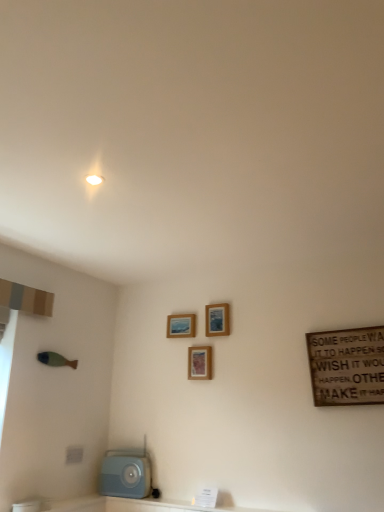
Question: From the image's perspective, is wooden signboard at right on light blue plastic radio at lower left?

Choices:
 (A) no
 (B) yes

Answer: (B)

Question: From a real-world perspective, is wooden signboard at right positioned over light blue plastic radio at lower left based on gravity?

Choices:
 (A) yes
 (B) no

Answer: (A)

Question: Can you confirm if wooden signboard at right is bigger than light blue plastic radio at lower left?

Choices:
 (A) yes
 (B) no

Answer: (B)

Question: From a real-world perspective, is wooden signboard at right physically below light blue plastic radio at lower left?

Choices:
 (A) no
 (B) yes

Answer: (A)

Question: Can you confirm if wooden signboard at right is shorter than light blue plastic radio at lower left?

Choices:
 (A) no
 (B) yes

Answer: (A)

Question: Considering the relative sizes of wooden signboard at right and light blue plastic radio at lower left in the image provided, is wooden signboard at right taller than light blue plastic radio at lower left?

Choices:
 (A) yes
 (B) no

Answer: (A)

Question: Can you confirm if wooden signboard at right is shorter than wooden picture frame at center, the second picture frame viewed from the right?

Choices:
 (A) yes
 (B) no

Answer: (B)

Question: Can you confirm if wooden signboard at right is positioned to the right of wooden picture frame at center, placed as the second picture frame when sorted from left to right?

Choices:
 (A) no
 (B) yes

Answer: (B)

Question: Can you confirm if wooden signboard at right is thinner than wooden picture frame at center, placed as the second picture frame when sorted from left to right?

Choices:
 (A) no
 (B) yes

Answer: (A)

Question: From the image's perspective, is wooden signboard at right under wooden picture frame at center, placed as the second picture frame when sorted from left to right?

Choices:
 (A) yes
 (B) no

Answer: (B)

Question: Is wooden signboard at right oriented away from wooden picture frame at center, the second picture frame viewed from the right?

Choices:
 (A) yes
 (B) no

Answer: (B)

Question: From a real-world perspective, is wooden signboard at right positioned under wooden picture frame at center, the second picture frame viewed from the right, based on gravity?

Choices:
 (A) yes
 (B) no

Answer: (A)

Question: Can you confirm if wooden picture frame at upper center, the first picture frame viewed from the left, is bigger than wooden picture frame at upper center, the 3th picture frame positioned from the left?

Choices:
 (A) no
 (B) yes

Answer: (B)